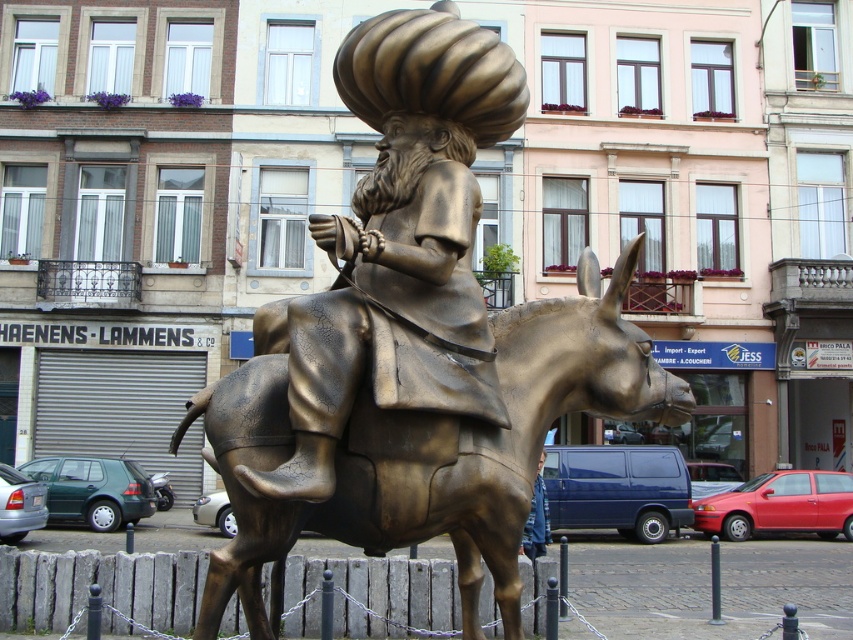
You are standing in the town square and want to take a photo of the bronze statue at center. If you are positioned at point 0.5, 0.5, which direction should you move to face the statue?

Since the bronze statue at center is located at point (399, 244) and you are at (426, 320), you should move slightly to the left and down to face the statue.